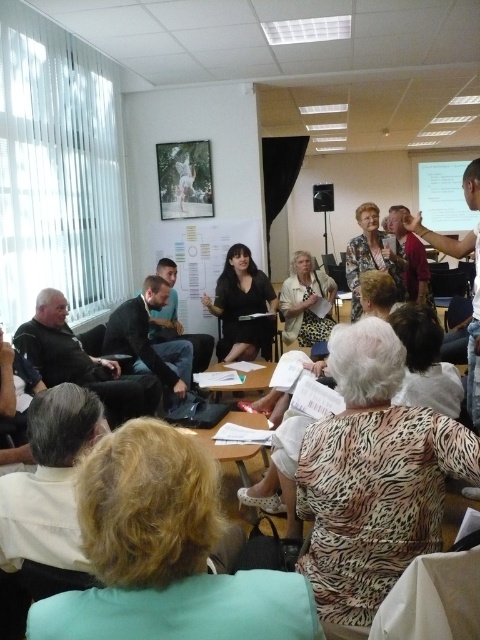
You are standing at the entrance of the conference room and see two points marked in the scene. The first point is at coordinates point (396,422) and the second is at point (230,349). Which point is closer to you as you face the room?

A: Point (396,422) is in front of point (230,349), so it is closer to you as you face the room.

You are a photographer positioned at the back of the room. You want to take a clear photo of the dark gray suit at center and the matte black microphone at center. Which object will appear larger in your photo?

The dark gray suit at center will appear larger in the photo because it is closer to the viewer than the matte black microphone at center.

You are attending a meeting and notice two attendees wearing leopard print blouse at center and black matte dress at center. Which clothing item is positioned lower on the person?

The leopard print blouse at center is positioned lower because it is below the black matte dress at center.